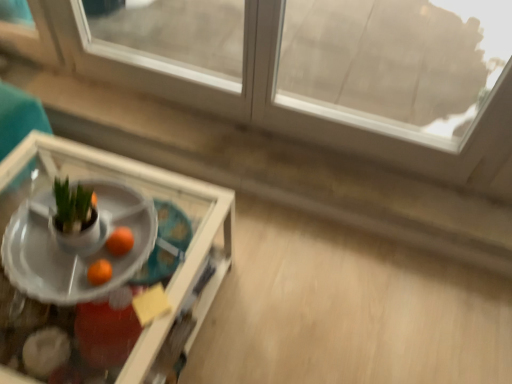
Question: Does point (119, 243) appear closer or farther from the camera than point (139, 254)?

Choices:
 (A) closer
 (B) farther

Answer: (A)

Question: Would you say orange matte at center is to the left or to the right of white glossy tray at center, which is counted as the second table, starting from the front, in the picture?

Choices:
 (A) left
 (B) right

Answer: (B)

Question: Which object is the closest to the white glossy tray at center, which is the first table from back to front?

Choices:
 (A) transparent glass window at upper center
 (B) clear glass tray at lower left, the second table from the back
 (C) orange matte at center

Answer: (B)

Question: Which is farther from the white glossy tray at center, which is counted as the second table, starting from the front?

Choices:
 (A) clear glass tray at lower left, the second table from the back
 (B) orange matte at center
 (C) transparent glass window at upper center

Answer: (C)